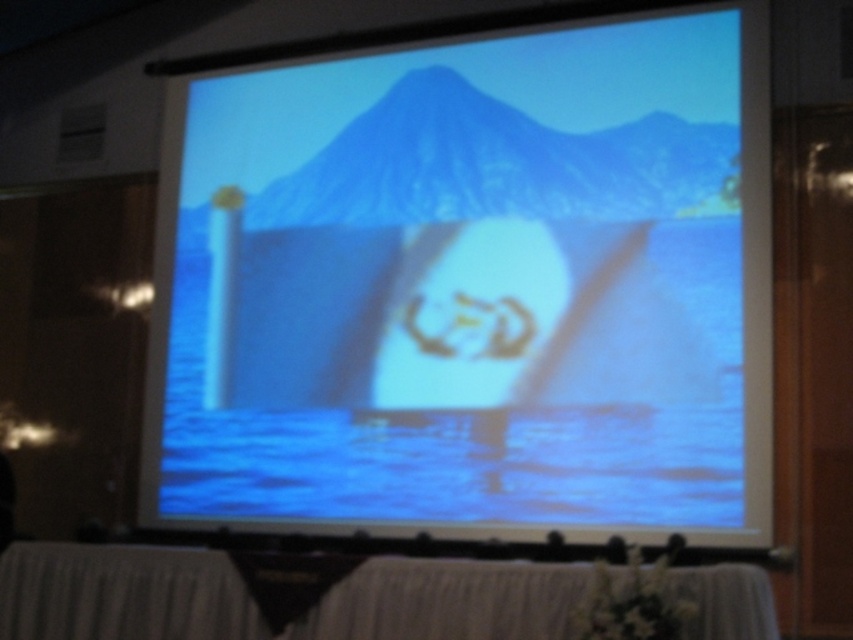
Can you confirm if white matte projection screen at center is positioned above white cloth at lower center?

Correct, white matte projection screen at center is located above white cloth at lower center.

Who is more distant from viewer, (x=312, y=310) or (x=397, y=568)?

Point (x=312, y=310)

What do you see at coordinates (469, 284) in the screenshot?
I see `white matte projection screen at center` at bounding box center [469, 284].

This screenshot has width=853, height=640. What are the coordinates of `white matte projection screen at center` in the screenshot? It's located at (469, 284).